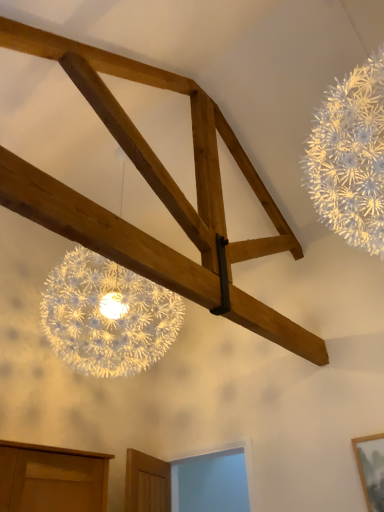
Question: Should I look upward or downward to see white textured lamp at lower left?

Choices:
 (A) up
 (B) down

Answer: (B)